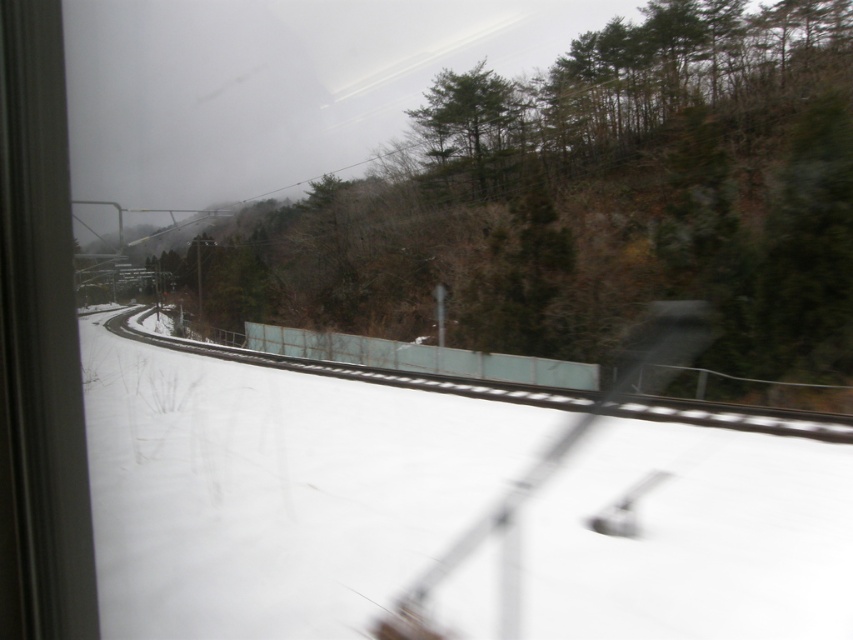
Does white snow at center have a larger size compared to green matte tree at upper center?

Actually, white snow at center might be smaller than green matte tree at upper center.

Who is lower down, white snow at center or green matte tree at upper center?

Positioned lower is white snow at center.

You are a GUI agent. You are given a task and a screenshot of the screen. Output one action in this format:
    pyautogui.click(x=<x>, y=<y>)
    Task: Click on the white snow at center
    Image resolution: width=853 pixels, height=640 pixels.
    Given the screenshot: What is the action you would take?
    pyautogui.click(x=276, y=490)

Locate an element on the screen. white snow at center is located at coordinates (276, 490).